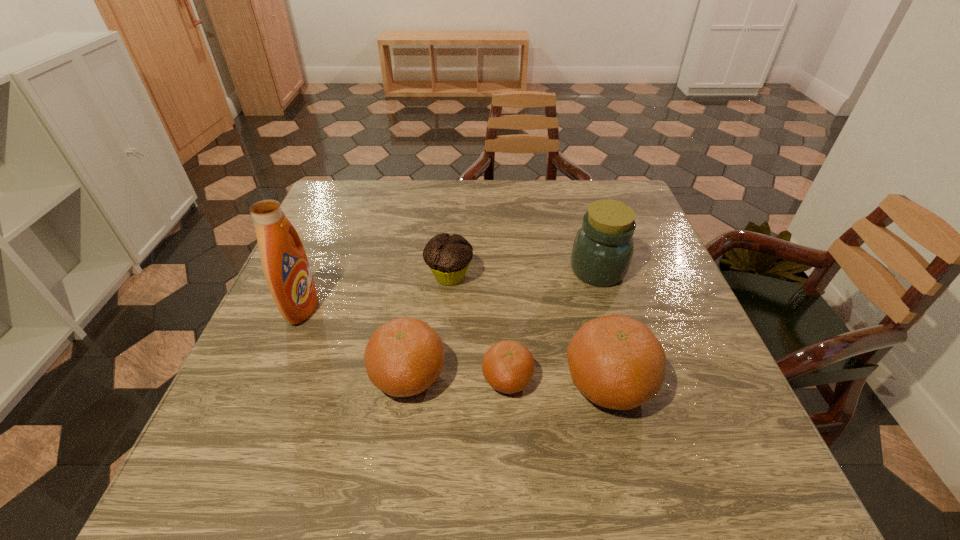
Given the evenly spaced clementines in the image, where should an extra clementine be added on the right to preserve the spacing? Please point to a vacant space. Please provide its 2D coordinates. Your answer should be formatted as a tuple, i.e. [(x, y)], where the tuple contains the x and y coordinates of a point satisfying the conditions above.

[(712, 387)]